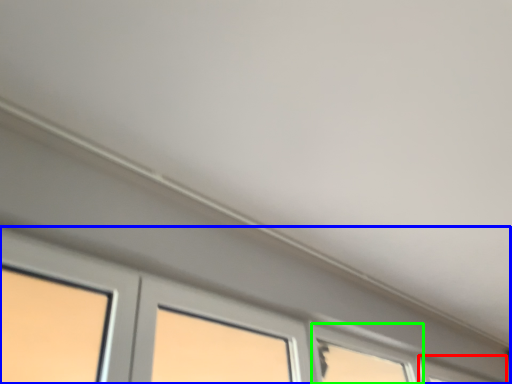
Question: Which is nearer to the window (highlighted by a red box)? window (highlighted by a blue box) or window (highlighted by a green box).

Choices:
 (A) window
 (B) window

Answer: (A)